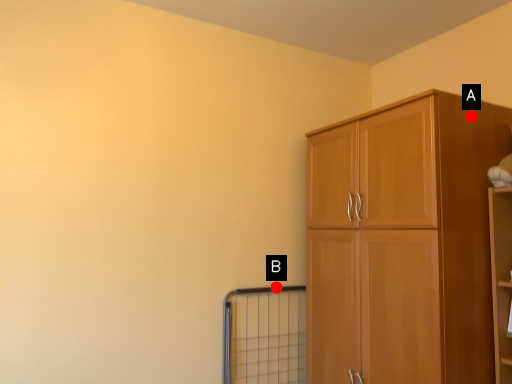
Question: Two points are circled on the image, labeled by A and B beside each circle. Which point is closer to the camera?

Choices:
 (A) A is closer
 (B) B is closer

Answer: (A)